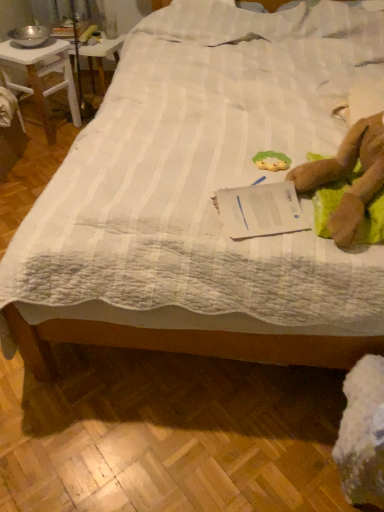
Question: Is green fabric toy at center positioned before brown plush toy at right?

Choices:
 (A) yes
 (B) no

Answer: (B)

Question: From a real-world perspective, does green fabric toy at center sit lower than brown plush toy at right?

Choices:
 (A) yes
 (B) no

Answer: (A)

Question: Are green fabric toy at center and brown plush toy at right located far from each other?

Choices:
 (A) yes
 (B) no

Answer: (B)

Question: From the image's perspective, is green fabric toy at center beneath brown plush toy at right?

Choices:
 (A) yes
 (B) no

Answer: (B)

Question: Considering the relative sizes of green fabric toy at center and brown plush toy at right in the image provided, is green fabric toy at center shorter than brown plush toy at right?

Choices:
 (A) no
 (B) yes

Answer: (B)

Question: Is green fabric toy at center looking in the opposite direction of brown plush toy at right?

Choices:
 (A) yes
 (B) no

Answer: (B)

Question: Is brown plush toy at right outside green fabric toy at center?

Choices:
 (A) yes
 (B) no

Answer: (A)

Question: From the image's perspective, is brown plush toy at right under green fabric toy at center?

Choices:
 (A) no
 (B) yes

Answer: (B)

Question: Does brown plush toy at right turn towards green fabric toy at center?

Choices:
 (A) yes
 (B) no

Answer: (A)

Question: Considering the relative sizes of brown plush toy at right and green fabric toy at center in the image provided, is brown plush toy at right bigger than green fabric toy at center?

Choices:
 (A) no
 (B) yes

Answer: (B)

Question: Can you confirm if brown plush toy at right is positioned to the left of green fabric toy at center?

Choices:
 (A) no
 (B) yes

Answer: (A)

Question: Are brown plush toy at right and green fabric toy at center making contact?

Choices:
 (A) no
 (B) yes

Answer: (A)

Question: From the image's perspective, is metallic silver bowl at upper left over white wood desk at upper left?

Choices:
 (A) yes
 (B) no

Answer: (A)